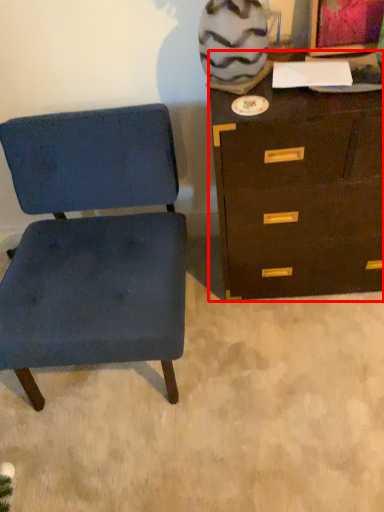
Question: Observing the image, what is the correct spatial positioning of chest of drawers (annotated by the red box) in reference to chair?

Choices:
 (A) right
 (B) left

Answer: (A)